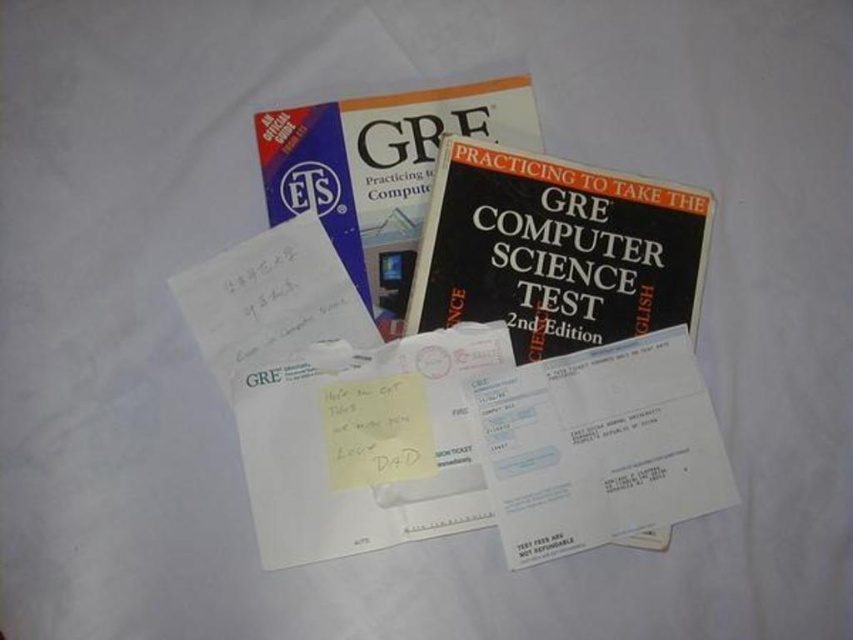
Question: Does hardcover book at center appear on the right side of yellow paper at center?

Choices:
 (A) yes
 (B) no

Answer: (A)

Question: Which object is the closest to the hardcover book at center?

Choices:
 (A) yellow paper at center
 (B) black matte book at center

Answer: (B)

Question: Can you confirm if black matte book at center is positioned to the right of yellow paper at center?

Choices:
 (A) no
 (B) yes

Answer: (B)

Question: Which of the following is the farthest from the observer?

Choices:
 (A) hardcover book at center
 (B) black matte book at center
 (C) yellow paper at center

Answer: (A)

Question: Which point is closer to the camera taking this photo?

Choices:
 (A) (546, 324)
 (B) (354, 472)
 (C) (402, 116)

Answer: (B)

Question: Where is black matte book at center located in relation to hardcover book at center in the image?

Choices:
 (A) right
 (B) left

Answer: (A)